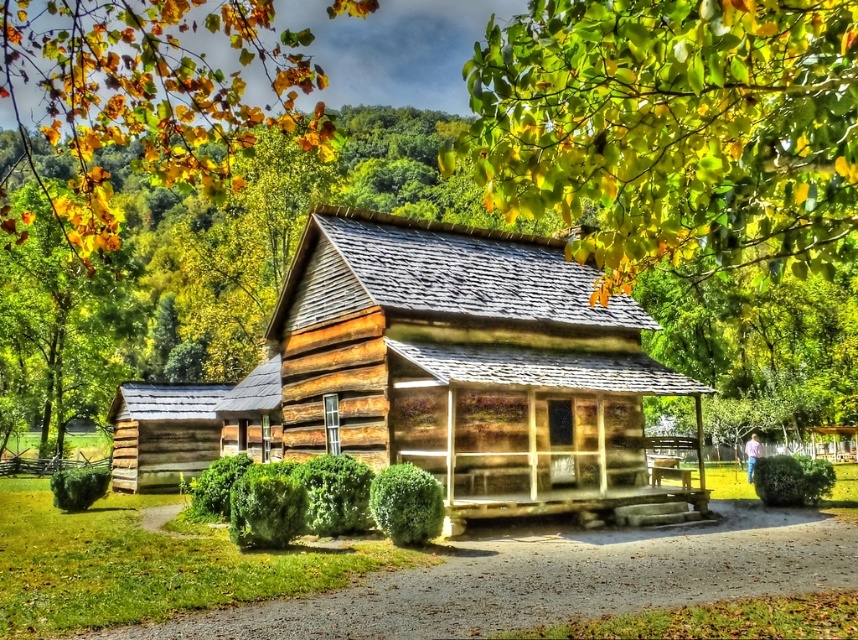
You are standing in front of the rustic log cabin and notice a specific point marked at coordinates point [672,129]. Based on the scene description, what natural element is located at that point?

The point [672,129] corresponds to yellow green leaves at upper center.